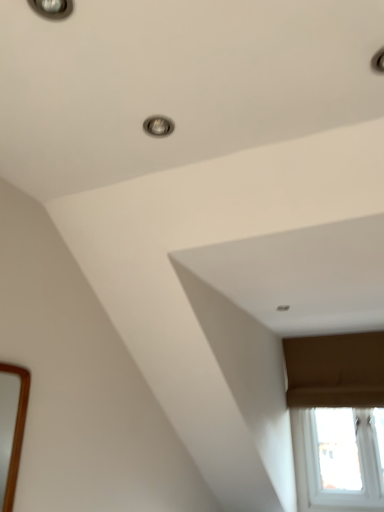
This screenshot has height=512, width=384. I want to click on matte brown curtain at lower right, so click(337, 418).

The width and height of the screenshot is (384, 512). Describe the element at coordinates (337, 418) in the screenshot. I see `matte brown curtain at lower right` at that location.

Measure the distance between point (x=325, y=419) and camera.

13.12 feet.

This screenshot has height=512, width=384. In order to click on matte brown curtain at lower right in this screenshot , I will do `click(337, 418)`.